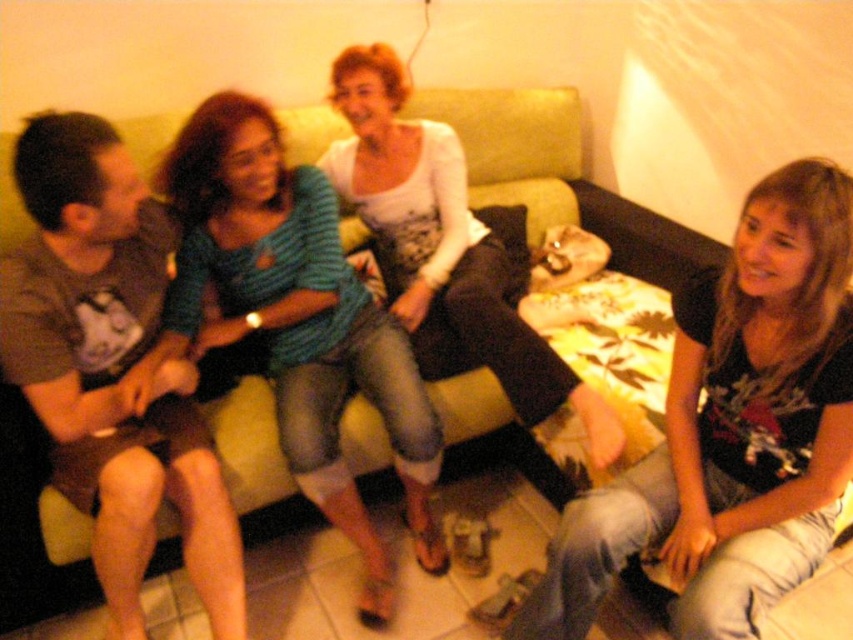
In the scene shown: Between black matte shirt at center and matte brown shirt at left, which one appears on the left side from the viewer's perspective?

matte brown shirt at left is more to the left.

Which is in front, point (762, 200) or point (193, 573)?

Positioned in front is point (762, 200).

Does point (810, 353) lie in front of point (134, 262)?

Yes, point (810, 353) is closer to viewer.

Where is `black matte shirt at center`? black matte shirt at center is located at coordinates (732, 429).

Does black matte shirt at center appear over white matte shirt at center?

Incorrect, black matte shirt at center is not positioned above white matte shirt at center.

Which is above, black matte shirt at center or white matte shirt at center?

Positioned higher is white matte shirt at center.

Who is more forward, (601, 500) or (404, 170)?

Point (601, 500) is in front.

Identify the location of black matte shirt at center. This screenshot has height=640, width=853. (x=732, y=429).

Can you confirm if matte brown shirt at left is positioned below blue striped shirt at center?

Correct, matte brown shirt at left is located below blue striped shirt at center.

Can you confirm if matte brown shirt at left is smaller than blue striped shirt at center?

Yes, matte brown shirt at left is smaller than blue striped shirt at center.

This screenshot has width=853, height=640. In order to click on matte brown shirt at left in this screenshot , I will do `click(111, 368)`.

Where is `matte brown shirt at left`? matte brown shirt at left is located at coordinates pos(111,368).